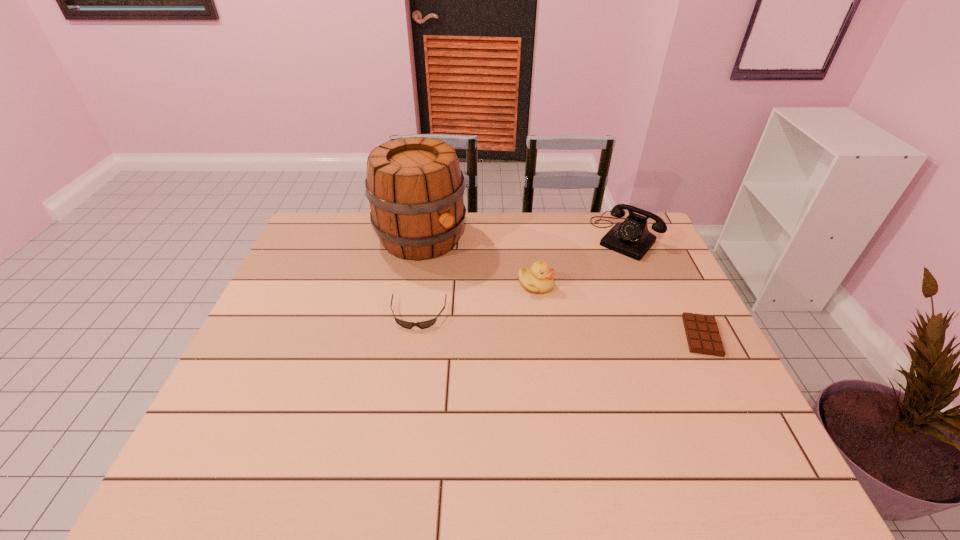
Where is `free space between the third nearest object and the telephone`? free space between the third nearest object and the telephone is located at coordinates [x=581, y=261].

This screenshot has height=540, width=960. I want to click on vacant area that lies between the tallest object and the fourth tallest object, so click(x=420, y=276).

At what (x,y) coordinates should I click in order to perform the action: click on free space between the third nearest object and the tallest object. Please return your answer as a coordinate pair (x, y). The image size is (960, 540). Looking at the image, I should click on (478, 261).

Where is `vacant space that's between the third tallest object and the telephone`? This screenshot has height=540, width=960. vacant space that's between the third tallest object and the telephone is located at coordinates (581, 261).

Where is `vacant space that's between the tallest object and the sunglasses`? The image size is (960, 540). vacant space that's between the tallest object and the sunglasses is located at coordinates (420, 276).

At what (x,y) coordinates should I click in order to perform the action: click on empty location between the cider and the telephone. Please return your answer as a coordinate pair (x, y). Looking at the image, I should click on (523, 237).

You are a GUI agent. You are given a task and a screenshot of the screen. Output one action in this format:
    pyautogui.click(x=<x>, y=<y>)
    Task: Click on the object that is the fourth closest to the tallest object
    The image size is (960, 540).
    Given the screenshot: What is the action you would take?
    pyautogui.click(x=702, y=333)

Where is `object that stands as the closest to the third nearest object`? object that stands as the closest to the third nearest object is located at coordinates [415, 187].

Identify the location of free location that satisfies the following two spatial constraints: 1. on the back side of the telephone; 2. on the right side of the third nearest object. This screenshot has width=960, height=540. (529, 238).